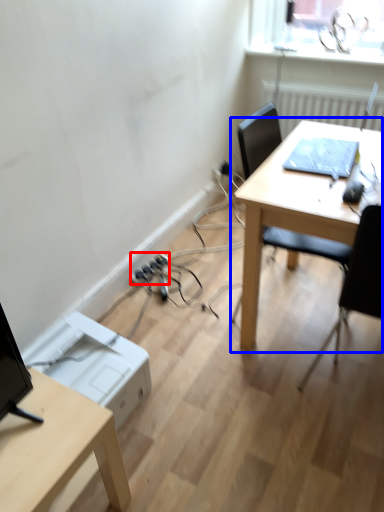
Question: Which object appears closest to the camera in this image, extension cord (highlighted by a red box) or table (highlighted by a blue box)?

Choices:
 (A) extension cord
 (B) table

Answer: (B)